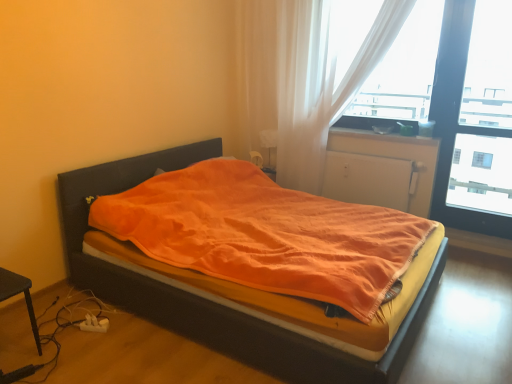
Find the location of `empty space that is to the right of white plastic charger at lower left`. empty space that is to the right of white plastic charger at lower left is located at coordinates point(126,331).